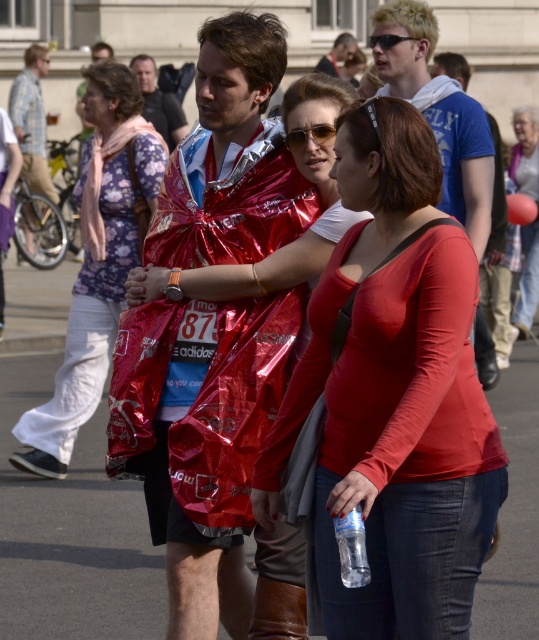
What do you see at coordinates (158, 102) in the screenshot? The width and height of the screenshot is (539, 640). I see `matte red raincoat at center` at bounding box center [158, 102].

Looking at this image, is matte red raincoat at center bigger than matte plastic bag at center?

No.

What are the coordinates of `matte red raincoat at center` in the screenshot? It's located at tap(158, 102).

Does brushed metal bicycle at left have a smaller size compared to matte red jacket at center?

Correct, brushed metal bicycle at left occupies less space than matte red jacket at center.

Does brushed metal bicycle at left have a lesser height compared to matte red jacket at center?

Yes.

Which is behind, point (24, 113) or point (522, 124)?

The point (24, 113) is more distant.

You are a GUI agent. You are given a task and a screenshot of the screen. Output one action in this format:
    pyautogui.click(x=<x>, y=<y>)
    Task: Click on the brushed metal bicycle at left
    This screenshot has height=640, width=539.
    Given the screenshot: What is the action you would take?
    pyautogui.click(x=31, y=122)

Does blue cotton t-shirt at center have a smaller size compared to matte red raincoat at center?

Incorrect, blue cotton t-shirt at center is not smaller in size than matte red raincoat at center.

Who is shorter, blue cotton t-shirt at center or matte red raincoat at center?

matte red raincoat at center

Is point (481, 317) behind point (169, 112)?

No, it is not.

Where is `blue cotton t-shirt at center`? blue cotton t-shirt at center is located at coordinates (438, 112).